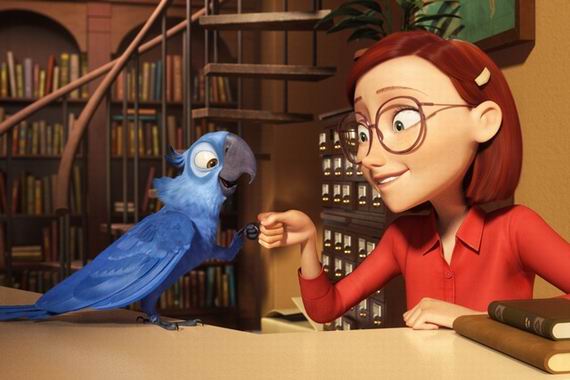
I want to click on pile of books, so click(x=541, y=311).